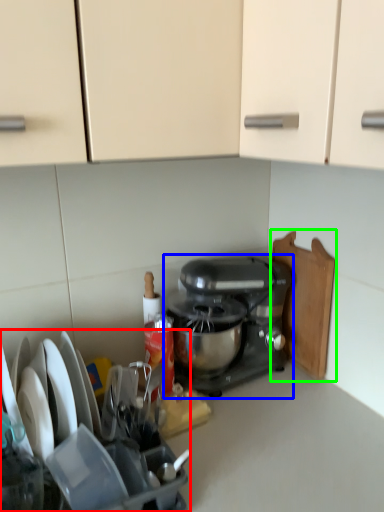
Question: Which object is the closest to the appliance (highlighted by a red box)? Choose among these: mixer (highlighted by a blue box) or cutting board (highlighted by a green box).

Choices:
 (A) mixer
 (B) cutting board

Answer: (A)